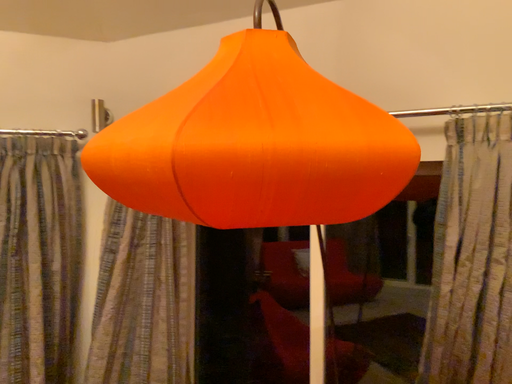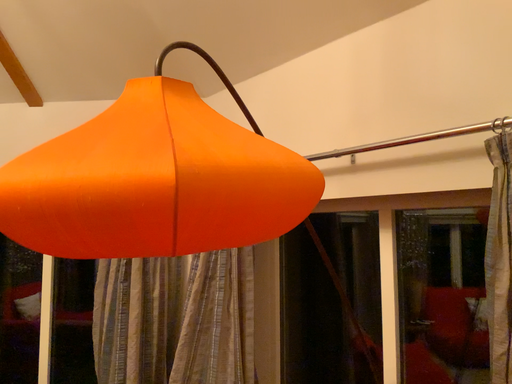
Question: How did the camera likely rotate when shooting the video?

Choices:
 (A) rotated left
 (B) rotated right

Answer: (A)